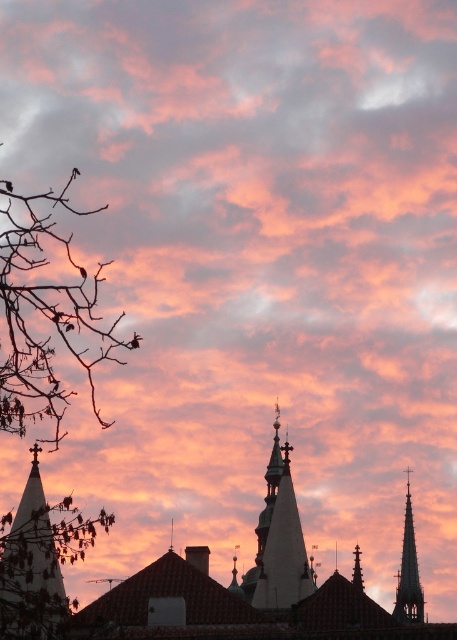
You are an artist sketching the sunset scene. You notice a point marked at coordinates (x=44, y=314). What object is located at that point?

The point at coordinates (x=44, y=314) indicates bare branches at left.

You are an architect analyzing the silhouette of two spires in the sunset image. Which spire, the white stone spire at center or the smooth gray spire at upper right, is placed higher in the sky?

The white stone spire at center is positioned over the smooth gray spire at upper right, meaning it is higher in the sky.